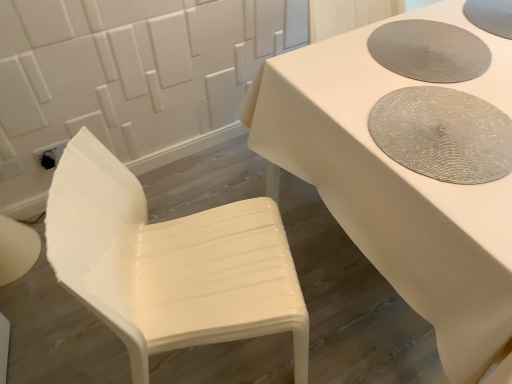
Find the location of a particular element. vacant point above textured gray mat at upper right, which is the 3th manhole cover in top-to-bottom order (from a real-world perspective) is located at coordinates (444, 123).